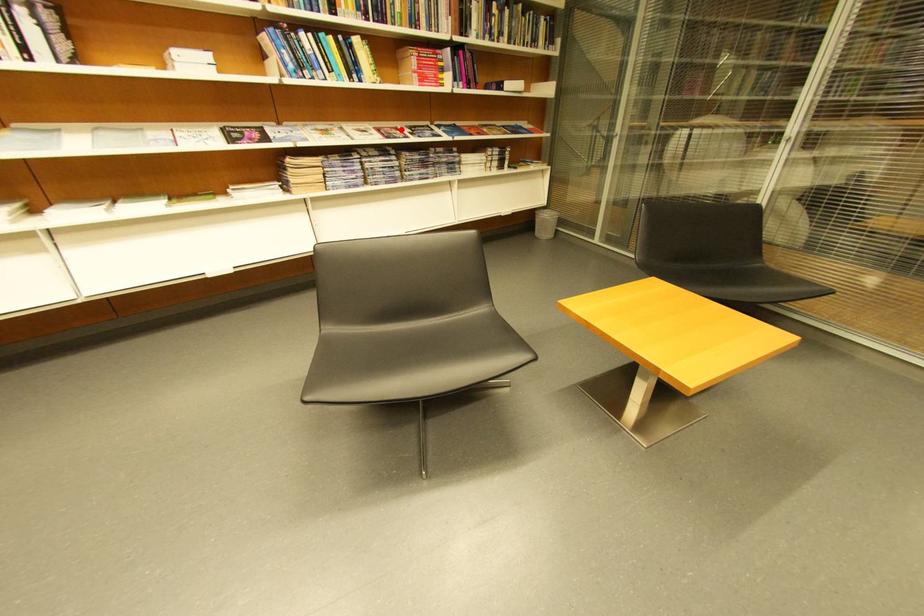
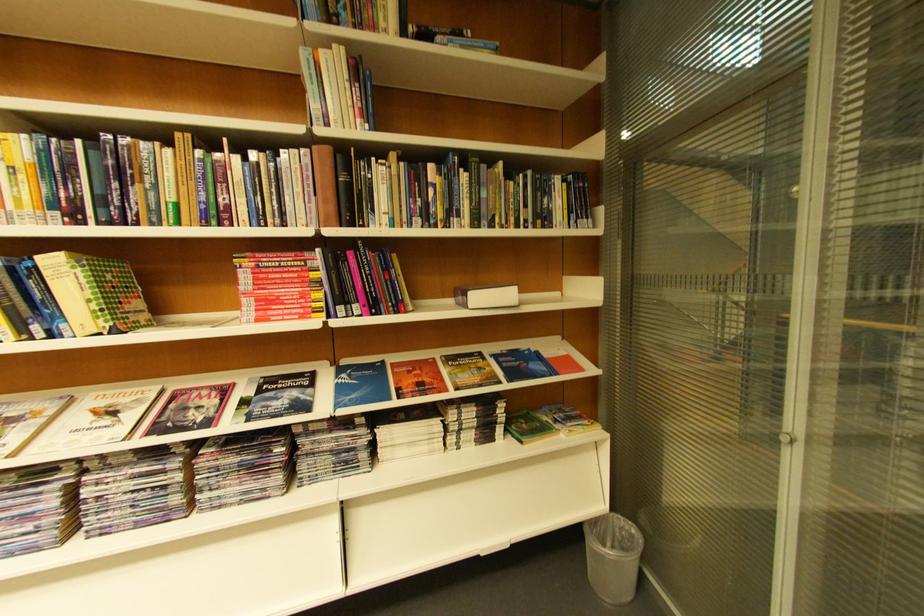
In the second image, find the point that corresponds to the highlighted location in the first image.

(224, 389)